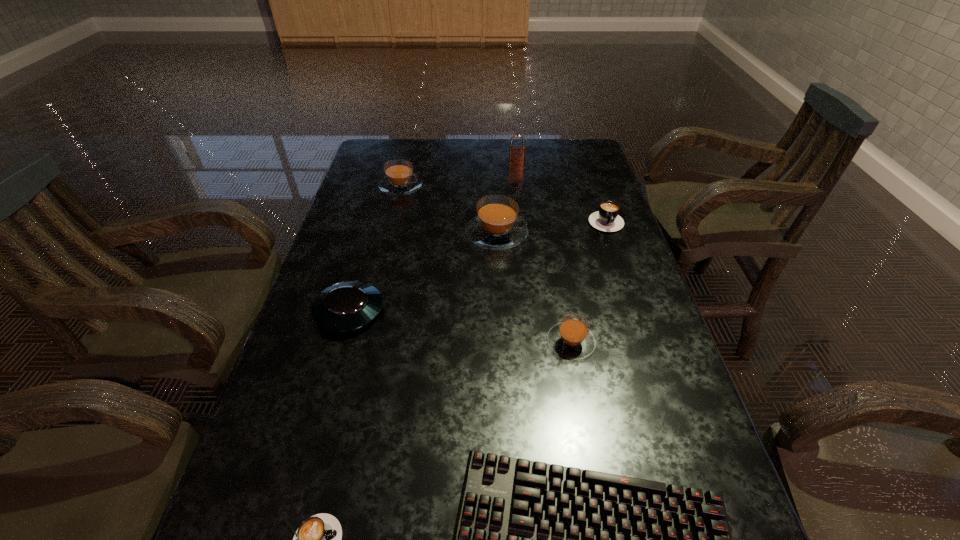
Image resolution: width=960 pixels, height=540 pixels. I want to click on free space between the second farthest brown cappuccino and the rightmost cappuccino, so click(551, 226).

Locate which object is the seventh closest to the right black cappuccino. Please provide its 2D coordinates. Your answer should be formatted as a tuple, i.e. [(x, y)], where the tuple contains the x and y coordinates of a point satisfying the conditions above.

[(318, 539)]

Find the location of a particular element. The height and width of the screenshot is (540, 960). the fifth closest object to the gray saucer is located at coordinates (400, 179).

Identify which cappuccino is the fifth closest to the shortest object. Please provide its 2D coordinates. Your answer should be formatted as a tuple, i.e. [(x, y)], where the tuple contains the x and y coordinates of a point satisfying the conditions above.

[(400, 179)]

Identify the location of the fifth closest cappuccino to the shortest object. The width and height of the screenshot is (960, 540). (400, 179).

You are a GUI agent. You are given a task and a screenshot of the screen. Output one action in this format:
    pyautogui.click(x=<x>, y=<y>)
    Task: Click on the brown cappuccino that stands as the third closest to the shortest object
    This screenshot has height=540, width=960.
    Given the screenshot: What is the action you would take?
    pyautogui.click(x=400, y=179)

Where is `brown cappuccino that stands as the third closest to the saucer`? This screenshot has width=960, height=540. brown cappuccino that stands as the third closest to the saucer is located at coordinates (400, 179).

This screenshot has height=540, width=960. What are the coordinates of `free space that satisfies the following two spatial constraints: 1. on the back side of the leftmost brown cappuccino; 2. on the right side of the gray saucer` in the screenshot? It's located at (385, 186).